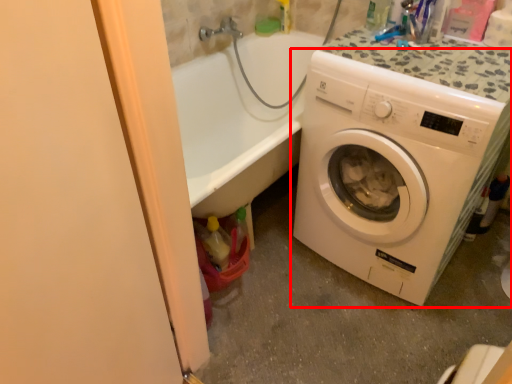
Question: From the image's perspective, what is the correct spatial positioning of washing machine (annotated by the red box) in reference to screen door?

Choices:
 (A) above
 (B) below

Answer: (A)